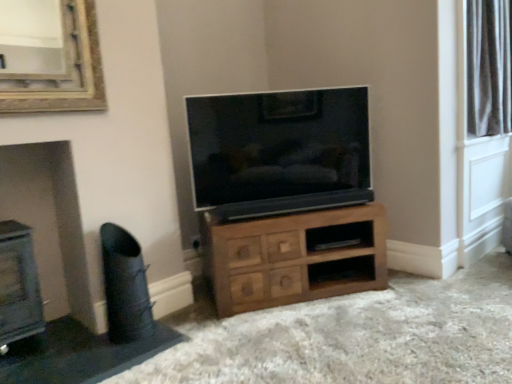
This screenshot has width=512, height=384. What are the coordinates of `vacant space to the right of blue painted wood fireplace at lower left` in the screenshot? It's located at (70, 353).